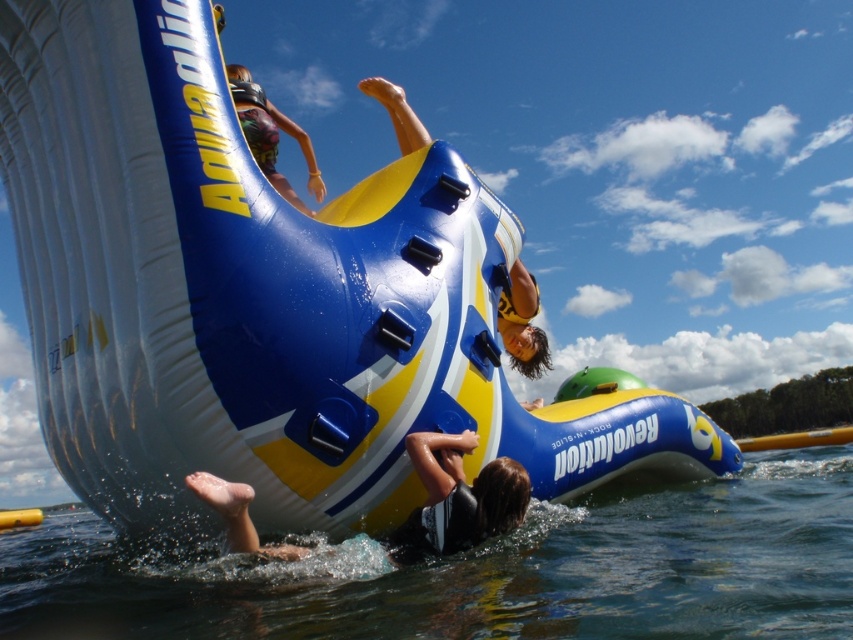
Based on the photo, you are standing at the base of the Aquaglide Revolution slide and want to place a floating ring in the water. The floating ring needs to be placed to the left of the multicolored fabric shorts at upper center. Can you confirm if the clear water at lower center is a suitable location for placing the floating ring?

The clear water at lower center is to the right of the multicolored fabric shorts at upper center, so placing the floating ring there would not meet the requirement of being to the left of the shorts. You should look for a spot to the left of the multicolored fabric shorts at upper center instead.

You are a safety inspector at the water park and need to ensure that the distance between the clear water at lower center and the multicolored fabric shorts at upper center is within the safety guidelines of 8 meters. Is the current distance compliant?

The clear water at lower center and multicolored fabric shorts at upper center are 8.51 meters apart, which exceeds the 8 meters safety guideline. Therefore, the distance is not compliant.